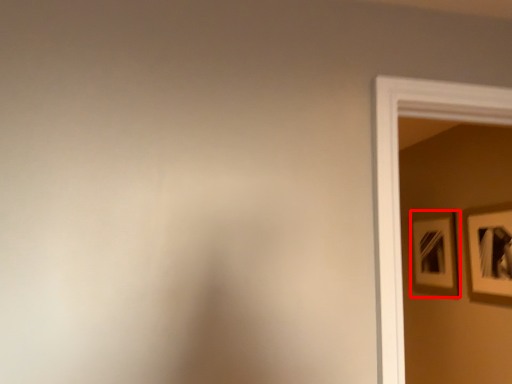
Question: From the image's perspective, considering the relative positions of picture frame (annotated by the red box) and picture frame in the image provided, where is picture frame (annotated by the red box) located with respect to the staircase?

Choices:
 (A) above
 (B) below

Answer: (B)